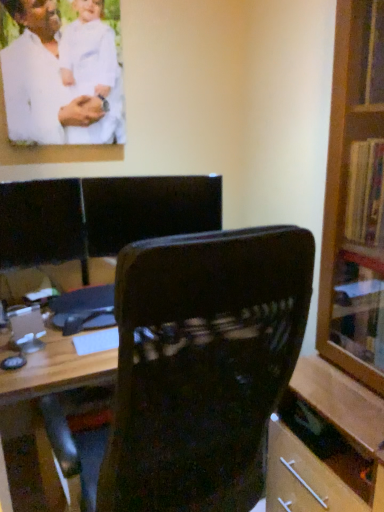
This screenshot has height=512, width=384. What do you see at coordinates (148, 209) in the screenshot?
I see `black leather chair at center` at bounding box center [148, 209].

In order to face white matte shirt at upper left, should I rotate leftwards or rightwards?

You should rotate left by 16.514 degrees.

The image size is (384, 512). Describe the element at coordinates (343, 301) in the screenshot. I see `wooden bookcase at right` at that location.

I want to click on black leather chair at center, so click(148, 209).

Considering the positions of points (96, 126) and (261, 284), is point (96, 126) farther from camera compared to point (261, 284)?

Yes.

Is white matte shirt at upper left positioned beyond the bounds of velvet-like dark brown chair at center?

Yes, white matte shirt at upper left is located beyond the bounds of velvet-like dark brown chair at center.

From the image's perspective, between white matte shirt at upper left and velvet-like dark brown chair at center, which one is located above?

white matte shirt at upper left is shown above in the image.

Would you say white matte shirt at upper left is a long distance from velvet-like dark brown chair at center?

white matte shirt at upper left is far away from velvet-like dark brown chair at center.

Does black leather chair at center have a larger size compared to velvet-like dark brown chair at center?

Incorrect, black leather chair at center is not larger than velvet-like dark brown chair at center.

Would you say black leather chair at center is inside or outside velvet-like dark brown chair at center?

black leather chair at center is spatially situated outside velvet-like dark brown chair at center.

From the image's perspective, is black leather chair at center over velvet-like dark brown chair at center?

Correct, black leather chair at center appears higher than velvet-like dark brown chair at center in the image.

Is the position of black leather chair at center more distant than that of velvet-like dark brown chair at center?

Yes, it is.

Consider the image. Which is nearer, (x=189, y=325) or (x=150, y=226)?

Point (x=189, y=325).

Which object is positioned more to the right, velvet-like dark brown chair at center or black leather chair at center?

Positioned to the right is velvet-like dark brown chair at center.

Is velvet-like dark brown chair at center not inside black leather chair at center?

Yes.

Is velvet-like dark brown chair at center turned away from black leather chair at center?

velvet-like dark brown chair at center does not have its back to black leather chair at center.

Can you confirm if black leather chair at center is taller than wooden bookcase at right?

No.

Locate an element on the screen. The image size is (384, 512). bookcase below the black leather chair at center (from the image's perspective) is located at coordinates (343, 301).

Is the surface of black leather chair at center in direct contact with wooden bookcase at right?

No, black leather chair at center is not next to wooden bookcase at right.

Is black leather chair at center positioned with its back to wooden bookcase at right?

No, black leather chair at center is not facing the opposite direction of wooden bookcase at right.

Which object is further away from the camera taking this photo, black leather chair at center or white matte shirt at upper left?

black leather chair at center.

From a real-world perspective, is black leather chair at center physically above white matte shirt at upper left?

No, from a real-world perspective, black leather chair at center is not above white matte shirt at upper left.

This screenshot has width=384, height=512. Identify the location of armchair that is under the white matte shirt at upper left (from a real-world perspective). (148, 209).

From the image's perspective, would you say black leather chair at center is shown under white matte shirt at upper left?

Indeed, from the image's perspective, black leather chair at center is shown beneath white matte shirt at upper left.

From the image's perspective, is wooden bookcase at right located above or below velvet-like dark brown chair at center?

Based on their image positions, wooden bookcase at right is located above velvet-like dark brown chair at center.

Does wooden bookcase at right turn towards velvet-like dark brown chair at center?

Yes, wooden bookcase at right is turned towards velvet-like dark brown chair at center.

Which object is wider, wooden bookcase at right or velvet-like dark brown chair at center?

velvet-like dark brown chair at center.

Can you tell me how much velvet-like dark brown chair at center and white matte shirt at upper left differ in facing direction?

The facing directions of velvet-like dark brown chair at center and white matte shirt at upper left are 178 degrees apart.

Who is taller, velvet-like dark brown chair at center or white matte shirt at upper left?

With more height is velvet-like dark brown chair at center.

From a real-world perspective, is velvet-like dark brown chair at center physically located above or below white matte shirt at upper left?

Clearly, from a real-world perspective, velvet-like dark brown chair at center is below white matte shirt at upper left.

Considering the points (203, 395) and (77, 30), which point is behind, point (203, 395) or point (77, 30)?

Point (77, 30)

You are a GUI agent. You are given a task and a screenshot of the screen. Output one action in this format:
    pyautogui.click(x=<x>, y=<y>)
    Task: Click on the man behind the velvet-like dark brown chair at center
    Image resolution: width=384 pixels, height=512 pixels.
    Given the screenshot: What is the action you would take?
    pyautogui.click(x=60, y=78)

Identify the location of chair that appears below the black leather chair at center (from a real-world perspective). The image size is (384, 512). (202, 364).

When comparing their distances from black leather chair at center, does velvet-like dark brown chair at center or white matte shirt at upper left seem closer?

white matte shirt at upper left is closer to black leather chair at center.

Estimate the real-world distances between objects in this image. Which object is closer to white matte shirt at upper left, velvet-like dark brown chair at center or black leather chair at center?

The object closer to white matte shirt at upper left is black leather chair at center.

Based on their spatial positions, is black leather chair at center or velvet-like dark brown chair at center closer to wooden bookcase at right?

velvet-like dark brown chair at center.

Estimate the real-world distances between objects in this image. Which object is closer to white matte shirt at upper left, black leather chair at center or velvet-like dark brown chair at center?

black leather chair at center is closer to white matte shirt at upper left.

Which object lies further to the anchor point black leather chair at center, white matte shirt at upper left or velvet-like dark brown chair at center?

Among the two, velvet-like dark brown chair at center is located further to black leather chair at center.

Looking at the image, which one is located further to white matte shirt at upper left, wooden bookcase at right or black leather chair at center?

Among the two, wooden bookcase at right is located further to white matte shirt at upper left.

When comparing their distances from wooden bookcase at right, does white matte shirt at upper left or black leather chair at center seem closer?

Based on the image, black leather chair at center appears to be nearer to wooden bookcase at right.

Looking at the image, which one is located closer to velvet-like dark brown chair at center, black leather chair at center or white matte shirt at upper left?

Based on the image, black leather chair at center appears to be nearer to velvet-like dark brown chair at center.

The height and width of the screenshot is (512, 384). What are the coordinates of `bookcase between white matte shirt at upper left and velvet-like dark brown chair at center in the up-down direction` in the screenshot? It's located at (343, 301).

Image resolution: width=384 pixels, height=512 pixels. I want to click on man between wooden bookcase at right and black leather chair at center along the z-axis, so click(60, 78).

Image resolution: width=384 pixels, height=512 pixels. I want to click on man between velvet-like dark brown chair at center and black leather chair at center along the z-axis, so click(x=60, y=78).

Find the location of `bookcase positioned between velvet-like dark brown chair at center and black leather chair at center from near to far`. bookcase positioned between velvet-like dark brown chair at center and black leather chair at center from near to far is located at coordinates (343, 301).